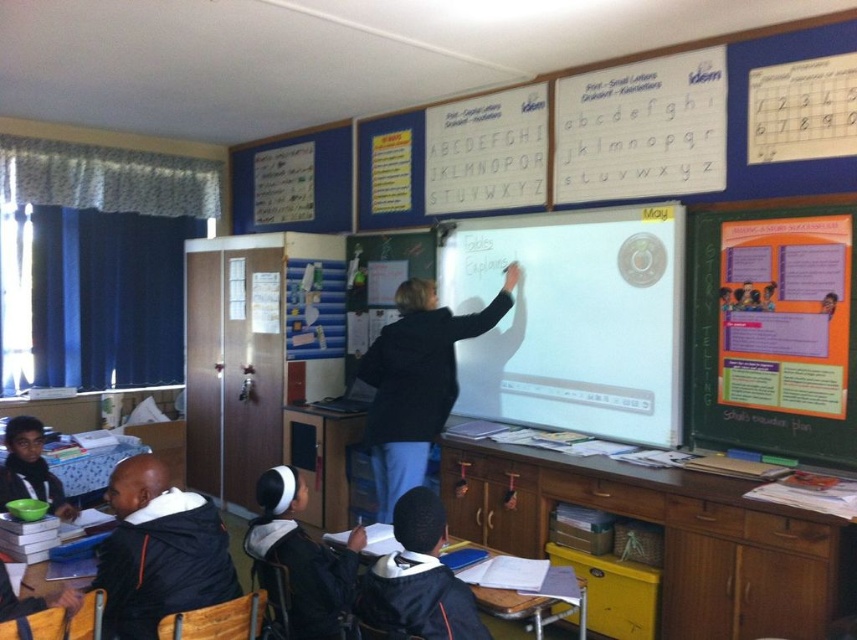
Question: Is orange paper poster at right wider than black jacket at lower left?

Choices:
 (A) no
 (B) yes

Answer: (B)

Question: Which point is closer to the camera taking this photo?

Choices:
 (A) (718, 308)
 (B) (151, 627)

Answer: (B)

Question: Which object is closer to the camera taking this photo?

Choices:
 (A) matte black bowl at lower left
 (B) black matte jacket at center

Answer: (A)

Question: Among these objects, which one is farthest from the camera?

Choices:
 (A) black jacket at lower left
 (B) black fabric backpack at center

Answer: (B)

Question: Does black jacket at lower left have a greater width compared to black fabric backpack at center?

Choices:
 (A) no
 (B) yes

Answer: (B)

Question: Does dark blue jacket at lower center have a greater width compared to black fabric backpack at center?

Choices:
 (A) no
 (B) yes

Answer: (A)